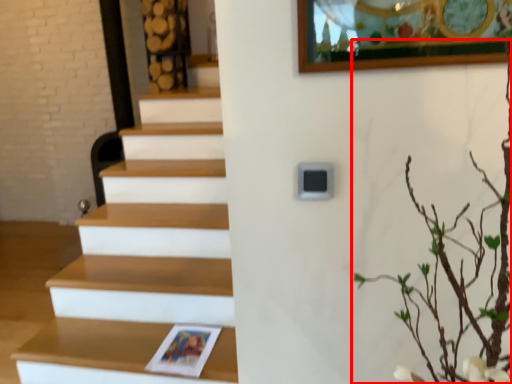
Question: Observing the image, what is the correct spatial positioning of tree (annotated by the red box) in reference to shelf?

Choices:
 (A) left
 (B) right

Answer: (B)